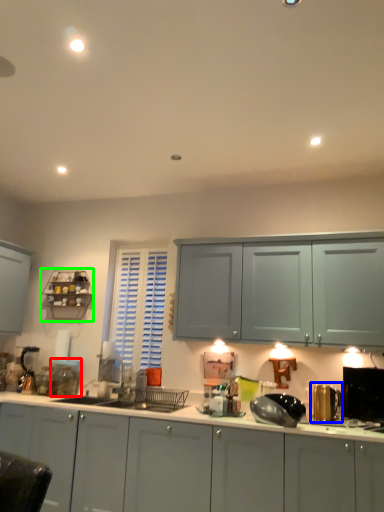
Question: Estimate the real-world distances between objects in this image. Which object is closer to appliance (highlighted by a red box), appliance (highlighted by a blue box) or shelf (highlighted by a green box)?

Choices:
 (A) appliance
 (B) shelf

Answer: (B)